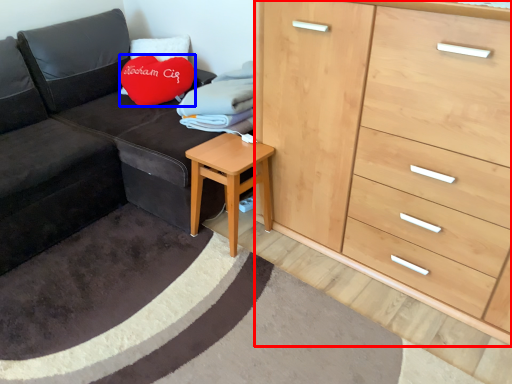
Question: Which of the following is the farthest to the observer, chest of drawers (highlighted by a red box) or throw pillow (highlighted by a blue box)?

Choices:
 (A) chest of drawers
 (B) throw pillow

Answer: (B)